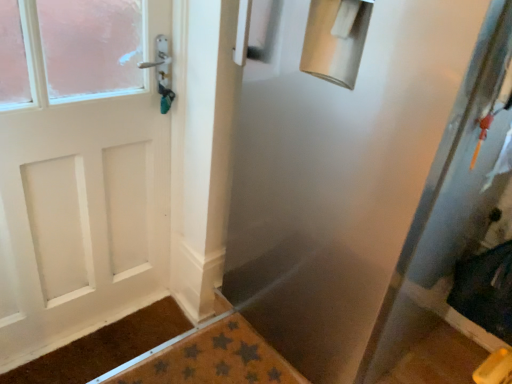
Question: Is brown textured mat at lower left touching transparent plastic screen door at center?

Choices:
 (A) no
 (B) yes

Answer: (A)

Question: Is brown textured mat at lower left oriented towards transparent plastic screen door at center?

Choices:
 (A) yes
 (B) no

Answer: (B)

Question: Is brown textured mat at lower left at the right side of transparent plastic screen door at center?

Choices:
 (A) yes
 (B) no

Answer: (B)

Question: Is brown textured mat at lower left to the left of transparent plastic screen door at center from the viewer's perspective?

Choices:
 (A) yes
 (B) no

Answer: (A)

Question: From the image's perspective, is brown textured mat at lower left on transparent plastic screen door at center?

Choices:
 (A) yes
 (B) no

Answer: (B)

Question: From a real-world perspective, is brown textured mat at lower left over transparent plastic screen door at center?

Choices:
 (A) yes
 (B) no

Answer: (B)

Question: From a real-world perspective, is transparent plastic screen door at center on top of brown textured mat at lower left?

Choices:
 (A) no
 (B) yes

Answer: (B)

Question: Is transparent plastic screen door at center positioned with its back to brown textured mat at lower left?

Choices:
 (A) no
 (B) yes

Answer: (A)

Question: From the image's perspective, is transparent plastic screen door at center beneath brown textured mat at lower left?

Choices:
 (A) yes
 (B) no

Answer: (B)

Question: Is transparent plastic screen door at center shorter than brown textured mat at lower left?

Choices:
 (A) yes
 (B) no

Answer: (B)

Question: Considering the relative sizes of transparent plastic screen door at center and brown textured mat at lower left in the image provided, is transparent plastic screen door at center smaller than brown textured mat at lower left?

Choices:
 (A) no
 (B) yes

Answer: (A)

Question: Can you confirm if transparent plastic screen door at center is wider than brown textured mat at lower left?

Choices:
 (A) yes
 (B) no

Answer: (A)

Question: Can you confirm if transparent plastic screen door at center is shorter than brown textured bath mat at lower center?

Choices:
 (A) yes
 (B) no

Answer: (B)